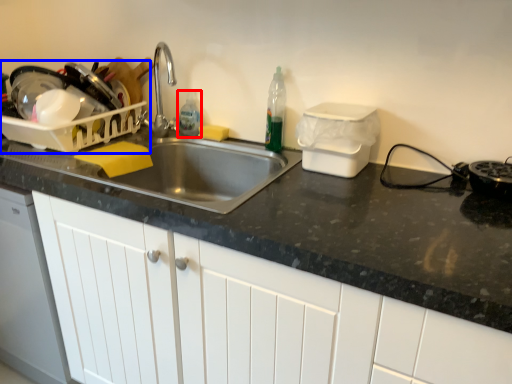
Question: Which of the following is the farthest to the observer, bottle (highlighted by a red box) or appliance (highlighted by a blue box)?

Choices:
 (A) bottle
 (B) appliance

Answer: (A)